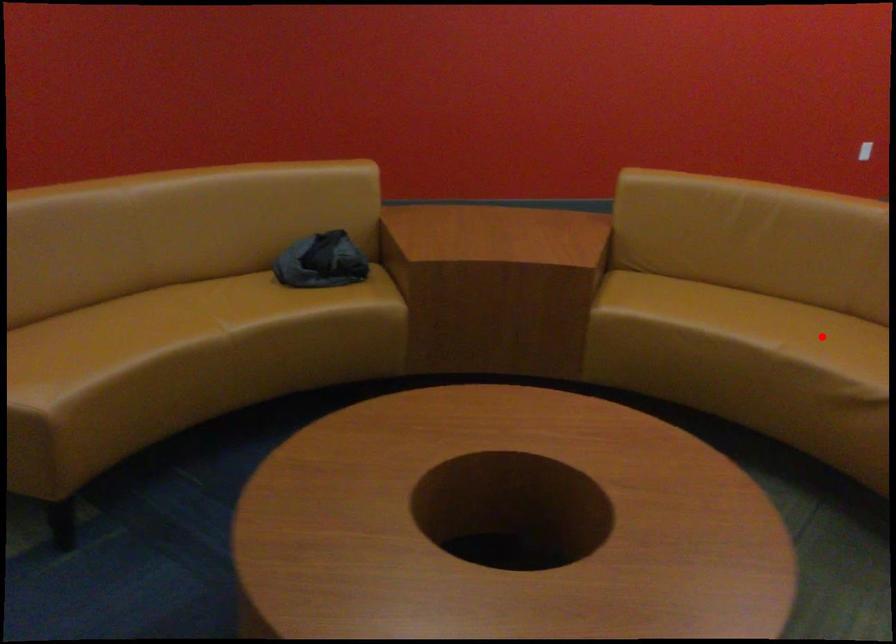
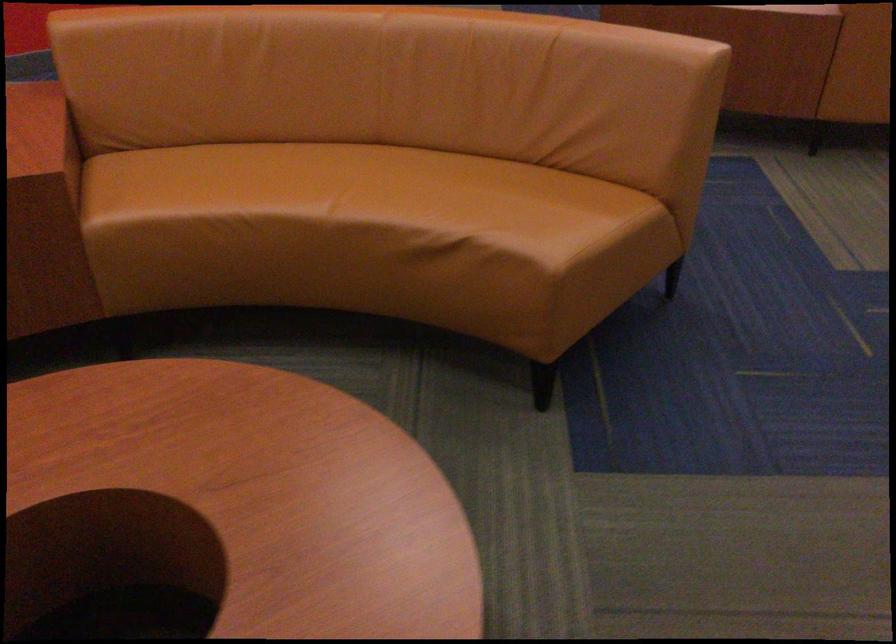
Question: I am providing you with two images of the same scene from different viewpoints. A red point is marked on the first image. Can you still see the location of the red point in image 2?

Choices:
 (A) Yes
 (B) No

Answer: (A)